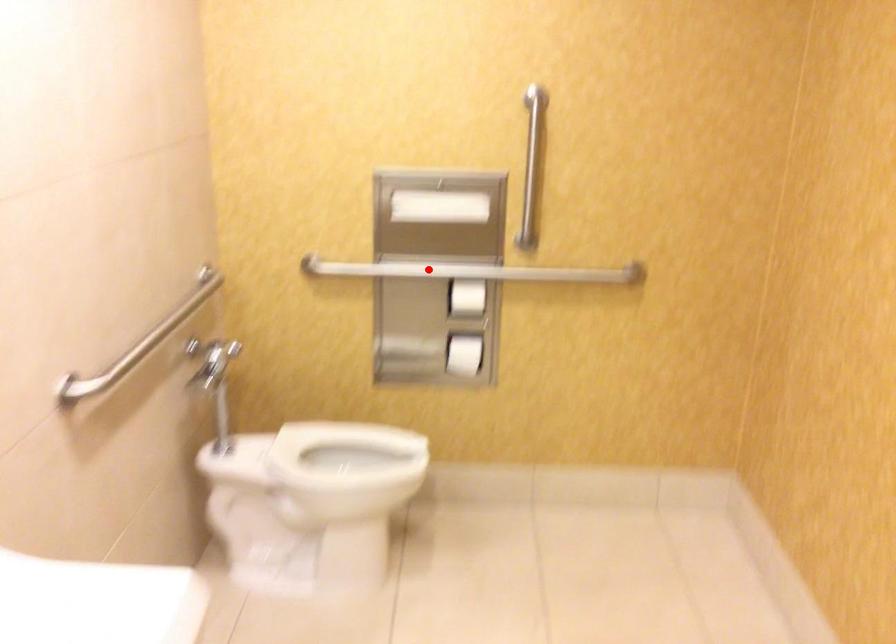
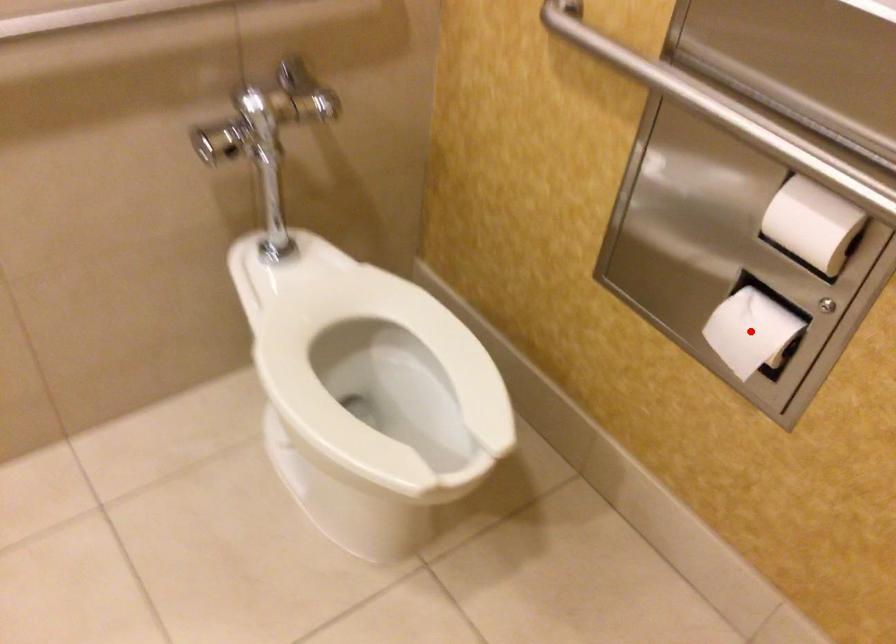
I am providing you with two images of the same scene from different viewpoints. A red point is marked on the first image and another point is marked on the second image. Is the marked point in image1 the same physical position as the marked point in image2?

No